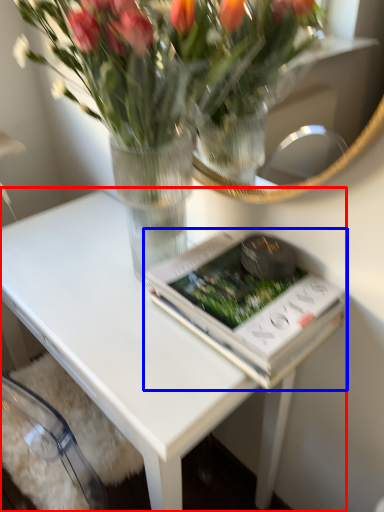
Question: Which object is closer to the camera taking this photo, table (highlighted by a red box) or paperback book (highlighted by a blue box)?

Choices:
 (A) table
 (B) paperback book

Answer: (A)